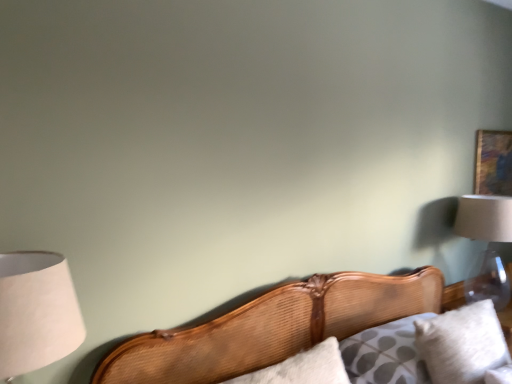
Where is `white paper lampshade at left, marked as the first lamp in a left-to-right arrangement`? This screenshot has height=384, width=512. white paper lampshade at left, marked as the first lamp in a left-to-right arrangement is located at coordinates (36, 312).

The width and height of the screenshot is (512, 384). Describe the element at coordinates (488, 245) in the screenshot. I see `clear glass lampshade at upper right, which appears as the 1th lamp when viewed from the back` at that location.

This screenshot has width=512, height=384. I want to click on white paper lampshade at left, marked as the first lamp in a left-to-right arrangement, so pos(36,312).

From a real-world perspective, is clear glass lampshade at upper right, positioned as the 1th lamp in right-to-left order, positioned above or below wooden bed at center?

In terms of real-world spatial position, clear glass lampshade at upper right, positioned as the 1th lamp in right-to-left order, is above wooden bed at center.

Considering the points (486, 203) and (273, 335), which point is in front, point (486, 203) or point (273, 335)?

The point (273, 335) is closer to the camera.

Considering the relative positions of clear glass lampshade at upper right, which ranks as the second lamp in front-to-back order, and wooden bed at center in the image provided, is clear glass lampshade at upper right, which ranks as the second lamp in front-to-back order, to the right of wooden bed at center from the viewer's perspective?

Yes.

Between point (27, 267) and point (500, 140), which one is positioned behind?

The point (500, 140) is farther.

Can you see white paper lampshade at left, arranged as the second lamp when viewed from the right, touching wooden picture frame at upper right?

white paper lampshade at left, arranged as the second lamp when viewed from the right, and wooden picture frame at upper right are clearly separated.

Is the position of white paper lampshade at left, the 2th lamp from the back, less distant than that of wooden picture frame at upper right?

Yes, the depth of white paper lampshade at left, the 2th lamp from the back, is less than that of wooden picture frame at upper right.

Is white paper lampshade at left, arranged as the second lamp when viewed from the right, completely or partially outside of wooden picture frame at upper right?

That's correct, white paper lampshade at left, arranged as the second lamp when viewed from the right, is outside of wooden picture frame at upper right.

Which is in front, point (282, 321) or point (474, 342)?

The point (474, 342) is closer.

Identify the location of bed below the white soft pillow at lower right (from the image's perspective). The width and height of the screenshot is (512, 384). (277, 327).

Based on their sizes in the image, would you say wooden bed at center is bigger or smaller than white soft pillow at lower right?

wooden bed at center is bigger than white soft pillow at lower right.

Can white soft pillow at lower right be found inside wooden bed at center?

Yes, white soft pillow at lower right is a part of wooden bed at center.

Does white paper lampshade at left, which appears as the 1th lamp when viewed from the front, lie behind white soft pillow at lower right?

No, white paper lampshade at left, which appears as the 1th lamp when viewed from the front, is closer to the camera.

Would you say white paper lampshade at left, arranged as the second lamp when viewed from the right, is inside or outside white soft pillow at lower right?

white paper lampshade at left, arranged as the second lamp when viewed from the right, is spatially situated outside white soft pillow at lower right.

At what (x,y) coordinates should I click in order to perform the action: click on pillow below the white paper lampshade at left, marked as the first lamp in a left-to-right arrangement (from a real-world perspective). Please return your answer as a coordinate pair (x, y). This screenshot has width=512, height=384. Looking at the image, I should click on (462, 344).

Is white paper lampshade at left, arranged as the second lamp when viewed from the right, next to white soft pillow at lower right and touching it?

No, white paper lampshade at left, arranged as the second lamp when viewed from the right, is not beside white soft pillow at lower right.

Choose the correct answer: Is wooden picture frame at upper right inside clear glass lampshade at upper right, the second lamp positioned from the left, or outside it?

wooden picture frame at upper right is located beyond the bounds of clear glass lampshade at upper right, the second lamp positioned from the left.

Considering the relative sizes of wooden picture frame at upper right and clear glass lampshade at upper right, which ranks as the second lamp in front-to-back order, in the image provided, is wooden picture frame at upper right thinner than clear glass lampshade at upper right, which ranks as the second lamp in front-to-back order,?

Yes.

Considering the sizes of objects wooden picture frame at upper right and clear glass lampshade at upper right, which appears as the 1th lamp when viewed from the back, in the image provided, who is shorter, wooden picture frame at upper right or clear glass lampshade at upper right, which appears as the 1th lamp when viewed from the back,?

With less height is clear glass lampshade at upper right, which appears as the 1th lamp when viewed from the back.

Considering the relative sizes of wooden picture frame at upper right and clear glass lampshade at upper right, positioned as the 1th lamp in right-to-left order, in the image provided, is wooden picture frame at upper right bigger than clear glass lampshade at upper right, positioned as the 1th lamp in right-to-left order,?

Incorrect, wooden picture frame at upper right is not larger than clear glass lampshade at upper right, positioned as the 1th lamp in right-to-left order.

Considering the relative positions of clear glass lampshade at upper right, positioned as the 1th lamp in right-to-left order, and white paper lampshade at left, which appears as the 1th lamp when viewed from the front, in the image provided, is clear glass lampshade at upper right, positioned as the 1th lamp in right-to-left order, behind white paper lampshade at left, which appears as the 1th lamp when viewed from the front,?

Yes, it is.

From the image's perspective, which is below, clear glass lampshade at upper right, which ranks as the second lamp in front-to-back order, or white paper lampshade at left, marked as the first lamp in a left-to-right arrangement?

white paper lampshade at left, marked as the first lamp in a left-to-right arrangement, is shown below in the image.

Is clear glass lampshade at upper right, which appears as the 1th lamp when viewed from the back, facing towards white paper lampshade at left, marked as the first lamp in a left-to-right arrangement?

No, clear glass lampshade at upper right, which appears as the 1th lamp when viewed from the back, is not aimed at white paper lampshade at left, marked as the first lamp in a left-to-right arrangement.

Image resolution: width=512 pixels, height=384 pixels. Identify the location of lamp located behind the white paper lampshade at left, the 2th lamp from the back. (488, 245).

In the scene shown: Can you tell me how much white paper lampshade at left, marked as the first lamp in a left-to-right arrangement, and wooden bed at center differ in facing direction?

0.367 degrees separate the facing orientations of white paper lampshade at left, marked as the first lamp in a left-to-right arrangement, and wooden bed at center.

Based on their sizes in the image, would you say white paper lampshade at left, the 2th lamp from the back, is bigger or smaller than wooden bed at center?

white paper lampshade at left, the 2th lamp from the back, is smaller than wooden bed at center.

Can you confirm if white paper lampshade at left, marked as the first lamp in a left-to-right arrangement, is taller than wooden bed at center?

In fact, white paper lampshade at left, marked as the first lamp in a left-to-right arrangement, may be shorter than wooden bed at center.

Is point (59, 281) less distant than point (336, 324)?

Yes, point (59, 281) is closer to viewer.

Identify the location of lamp on the right side of wooden bed at center. (488, 245).

Locate an element on the screen. Image resolution: width=512 pixels, height=384 pixels. picture frame above the white paper lampshade at left, marked as the first lamp in a left-to-right arrangement (from the image's perspective) is located at coordinates (493, 163).

When comparing their distances from wooden picture frame at upper right, does wooden cushion at lower right or wooden bed at center seem further?

wooden cushion at lower right is further to wooden picture frame at upper right.

In the scene shown: Considering their positions, is wooden bed at center positioned closer to clear glass lampshade at upper right, the second lamp positioned from the left, than wooden picture frame at upper right?

wooden picture frame at upper right.

Which object lies further to the anchor point white paper lampshade at left, which appears as the 1th lamp when viewed from the front, white soft pillow at lower right or wooden bed at center?

white soft pillow at lower right is further to white paper lampshade at left, which appears as the 1th lamp when viewed from the front.

Based on the photo, which object lies further to the anchor point wooden bed at center, white paper lampshade at left, which appears as the 1th lamp when viewed from the front, or wooden picture frame at upper right?

Based on the image, wooden picture frame at upper right appears to be further to wooden bed at center.

Which object lies nearer to the anchor point wooden cushion at lower right, white soft pillow at lower right or clear glass lampshade at upper right, positioned as the 1th lamp in right-to-left order?

The object closer to wooden cushion at lower right is white soft pillow at lower right.

Estimate the real-world distances between objects in this image. Which object is closer to wooden bed at center, clear glass lampshade at upper right, which appears as the 1th lamp when viewed from the back, or wooden picture frame at upper right?

The object closer to wooden bed at center is clear glass lampshade at upper right, which appears as the 1th lamp when viewed from the back.

Which object lies nearer to the anchor point wooden bed at center, wooden picture frame at upper right or white soft pillow at lower right?

white soft pillow at lower right lies closer to wooden bed at center than the other object.

Looking at the image, which one is located closer to clear glass lampshade at upper right, which appears as the 1th lamp when viewed from the back, wooden bed at center or wooden cushion at lower right?

wooden bed at center is closer to clear glass lampshade at upper right, which appears as the 1th lamp when viewed from the back.

This screenshot has width=512, height=384. I want to click on pillow positioned between wooden bed at center and wooden picture frame at upper right from near to far, so point(462,344).

You are a GUI agent. You are given a task and a screenshot of the screen. Output one action in this format:
    pyautogui.click(x=<x>, y=<y>)
    Task: Click on the lamp situated between white paper lampshade at left, arranged as the second lamp when viewed from the right, and wooden picture frame at upper right from left to right
    
    Given the screenshot: What is the action you would take?
    pyautogui.click(x=488, y=245)

Locate an element on the screen. This screenshot has width=512, height=384. lamp between wooden cushion at lower right and wooden picture frame at upper right in the front-back direction is located at coordinates (488, 245).

Where is `bed between white paper lampshade at left, arranged as the second lamp when viewed from the right, and wooden cushion at lower right, in the horizontal direction`? bed between white paper lampshade at left, arranged as the second lamp when viewed from the right, and wooden cushion at lower right, in the horizontal direction is located at coordinates (277, 327).